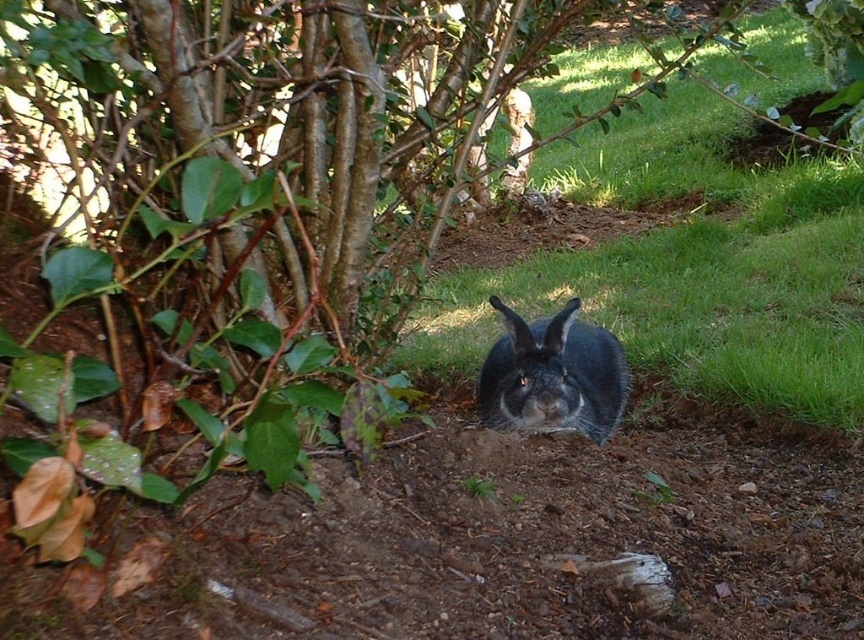
You are standing in the garden and want to place a small potted plant exactly where the green grass at center is. Can you confirm the coordinates where you should place it?

The green grass at center is located at point (x=691, y=268), so you should place the potted plant at those coordinates.